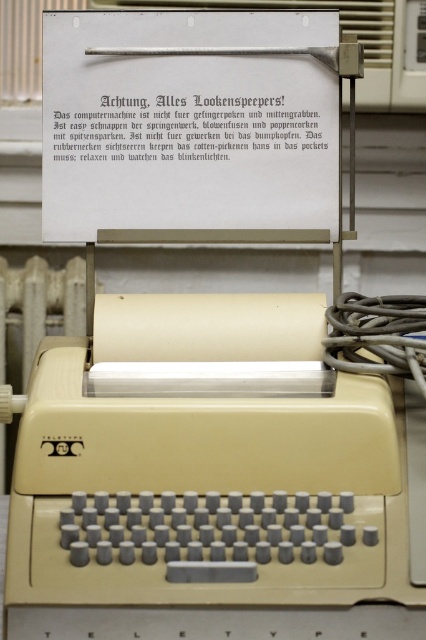
What is the relationship between the white paper at upper center and the beige plastic radiator at lower left in terms of their positions?

The white paper at upper center is positioned in front of the beige plastic radiator at lower left, meaning the radiator is located behind the paper from the viewer perspective.

What is the spatial relationship between the white paper at upper center and the beige plastic radiator at lower left?

The white paper at upper center is positioned above the beige plastic radiator at lower left.